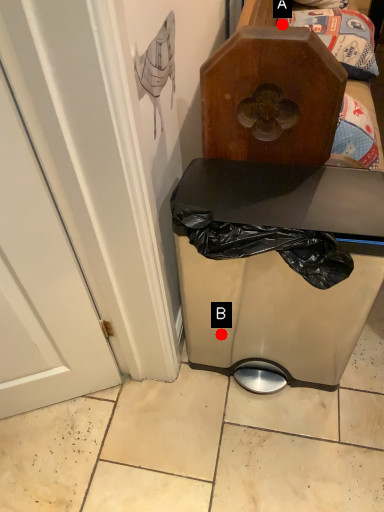
Question: Two points are circled on the image, labeled by A and B beside each circle. Among these points, which one is nearest to the camera?

Choices:
 (A) A is closer
 (B) B is closer

Answer: (B)